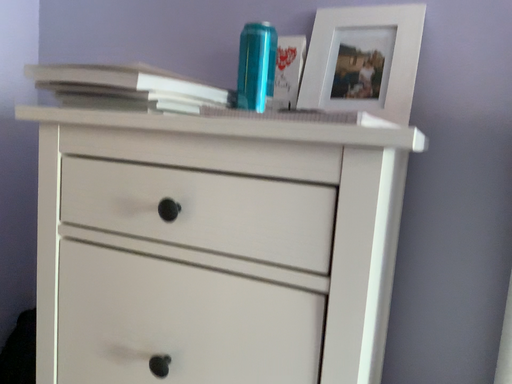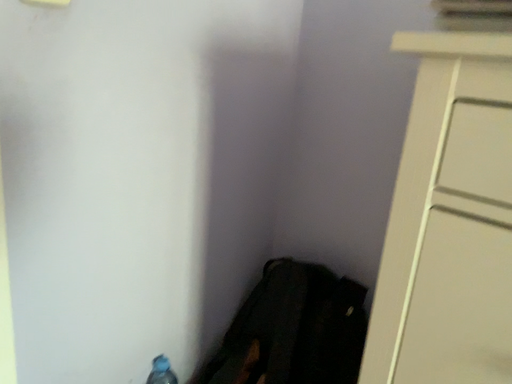
Question: Which way did the camera rotate in the video?

Choices:
 (A) rotated left
 (B) rotated right

Answer: (A)